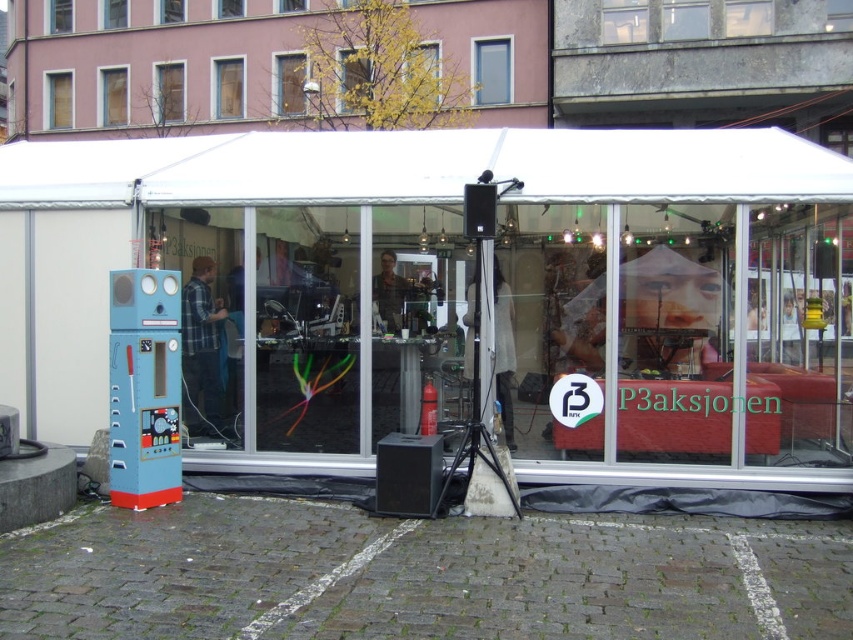
Question: Is white fabric canopy at upper center thinner than blue painted metal vending machine at left?

Choices:
 (A) no
 (B) yes

Answer: (A)

Question: Among these points, which one is farthest from the camera?

Choices:
 (A) (180, 480)
 (B) (76, 168)

Answer: (B)

Question: Among these points, which one is farthest from the camera?

Choices:
 (A) (128, 413)
 (B) (335, 140)

Answer: (B)

Question: Which point is closer to the camera?

Choices:
 (A) blue painted metal vending machine at left
 (B) white fabric canopy at upper center

Answer: (A)

Question: Is white fabric canopy at upper center below blue painted metal vending machine at left?

Choices:
 (A) yes
 (B) no

Answer: (B)

Question: Can you confirm if white fabric canopy at upper center is bigger than blue painted metal vending machine at left?

Choices:
 (A) yes
 (B) no

Answer: (A)